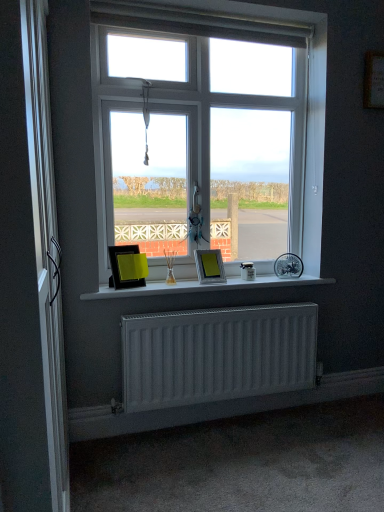
Question: Which direction should I rotate to look at matte black picture frame at center, marked as the 1th picture frame in a left-to-right arrangement?

Choices:
 (A) right
 (B) left

Answer: (B)

Question: Which direction should I rotate to face metallic silver picture frame at center, which ranks as the 1th picture frame in right-to-left order, — up or down?

Choices:
 (A) up
 (B) down

Answer: (B)

Question: From a real-world perspective, is white plastic window at center over white matte window sill at center?

Choices:
 (A) no
 (B) yes

Answer: (B)

Question: Does white plastic window at center appear on the right side of white matte window sill at center?

Choices:
 (A) no
 (B) yes

Answer: (A)

Question: Can you confirm if white plastic window at center is shorter than white matte window sill at center?

Choices:
 (A) yes
 (B) no

Answer: (B)

Question: Is white plastic window at center positioned behind white matte window sill at center?

Choices:
 (A) no
 (B) yes

Answer: (B)

Question: Can you confirm if white plastic window at center is bigger than white matte window sill at center?

Choices:
 (A) yes
 (B) no

Answer: (A)

Question: Are white plastic window at center and white matte window sill at center making contact?

Choices:
 (A) yes
 (B) no

Answer: (B)

Question: From the image's perspective, is silver metallic screen door at left under metallic silver picture frame at center, the second picture frame viewed from the left?

Choices:
 (A) yes
 (B) no

Answer: (A)

Question: Considering the relative sizes of silver metallic screen door at left and metallic silver picture frame at center, the second picture frame viewed from the left, in the image provided, is silver metallic screen door at left thinner than metallic silver picture frame at center, the second picture frame viewed from the left,?

Choices:
 (A) no
 (B) yes

Answer: (B)

Question: From a real-world perspective, is silver metallic screen door at left below metallic silver picture frame at center, the second picture frame viewed from the left?

Choices:
 (A) yes
 (B) no

Answer: (B)

Question: From the image's perspective, is silver metallic screen door at left above metallic silver picture frame at center, which ranks as the 1th picture frame in right-to-left order?

Choices:
 (A) no
 (B) yes

Answer: (A)

Question: Can you confirm if silver metallic screen door at left is shorter than metallic silver picture frame at center, the second picture frame viewed from the left?

Choices:
 (A) yes
 (B) no

Answer: (B)

Question: Could you tell me if silver metallic screen door at left is facing metallic silver picture frame at center, the second picture frame viewed from the left?

Choices:
 (A) no
 (B) yes

Answer: (A)

Question: From the image's perspective, is white matte radiator at lower center beneath silver metallic screen door at left?

Choices:
 (A) yes
 (B) no

Answer: (A)